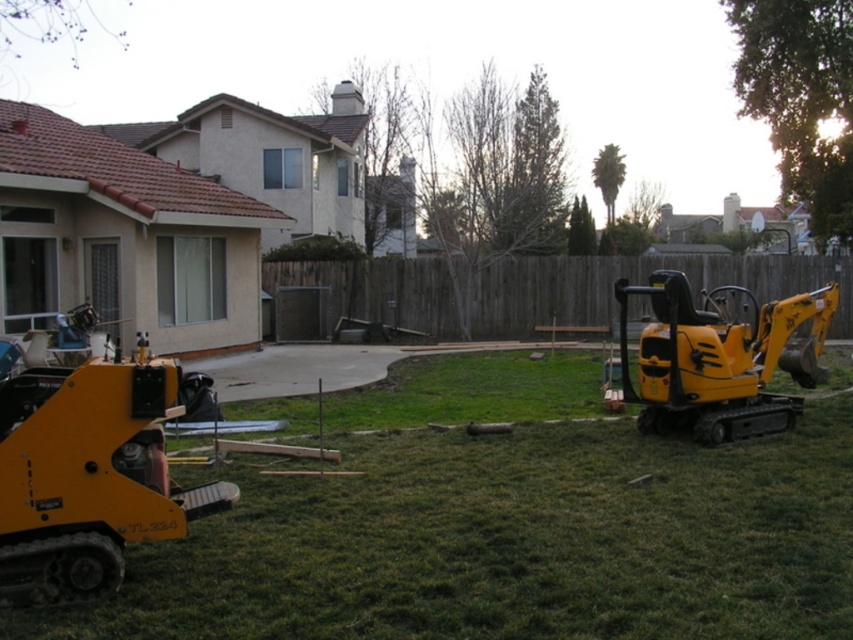
Locate an element on the screen. green grass at lower center is located at coordinates (503, 525).

Who is more distant from viewer, [233,406] or [88,588]?

Point [233,406]

Who is more forward, (x=804, y=593) or (x=137, y=518)?

Positioned in front is point (x=804, y=593).

Find the location of a particular element. green grass at lower center is located at coordinates (503, 525).

Does wooden fence at center appear on the left side of yellow rubber excavator at right?

Yes, wooden fence at center is to the left of yellow rubber excavator at right.

This screenshot has height=640, width=853. Describe the element at coordinates (636, 284) in the screenshot. I see `wooden fence at center` at that location.

Find the location of a particular element. This screenshot has width=853, height=640. wooden fence at center is located at coordinates (636, 284).

Which of these two, green grass at lower center or yellow rubber excavator at right, stands shorter?

green grass at lower center

Locate an element on the screen. This screenshot has width=853, height=640. green grass at lower center is located at coordinates (503, 525).